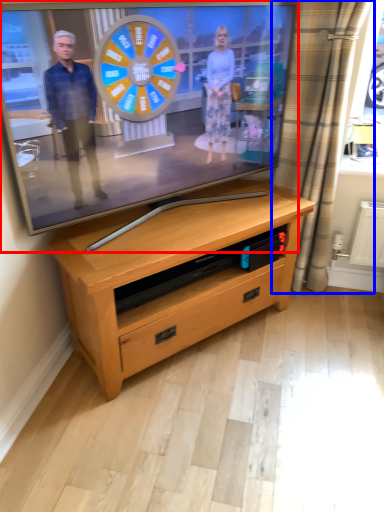
Question: Which point is closer to the camera, television (highlighted by a red box) or curtain (highlighted by a blue box)?

Choices:
 (A) television
 (B) curtain

Answer: (A)